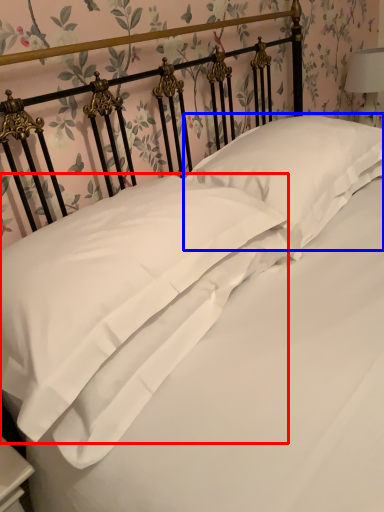
Question: Which of the following is the farthest to the observer, pillow (highlighted by a red box) or pillow (highlighted by a blue box)?

Choices:
 (A) pillow
 (B) pillow

Answer: (B)